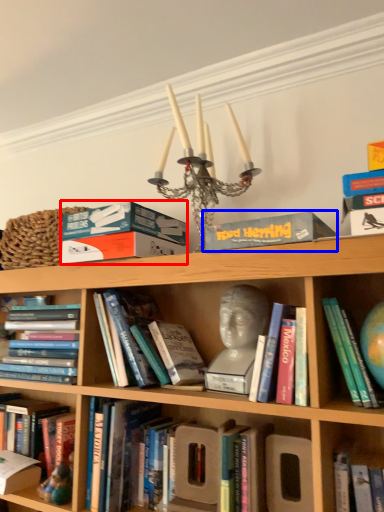
Question: Which point is further to the camera, paperback book (highlighted by a red box) or paperback book (highlighted by a blue box)?

Choices:
 (A) paperback book
 (B) paperback book

Answer: (A)